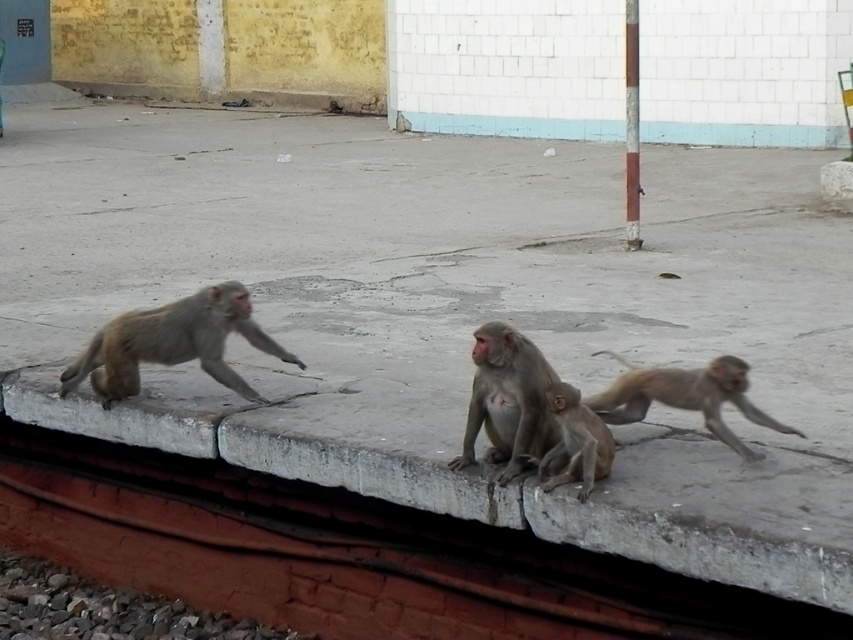
You are a photographer trying to capture a photo of the brown fur monkey at center. You are standing on the gray concrete ledge at center. To get a clear shot, you need to know the relative positions of these two objects. Which object is on the left side from your perspective?

The gray concrete ledge at center is positioned on the left side of brown fur monkey at center, so from your perspective standing on the ledge, the ledge itself is to your left, and the monkey is to your right.

You are a photographer trying to capture a photo of the light brown fur monkey at left and the gray concrete ledge at center. Based on their positions, which object is located to the right of the other?

The gray concrete ledge at center is positioned on the right side of light brown fur monkey at left, so the gray concrete ledge at center is to the right of the light brown fur monkey at left.